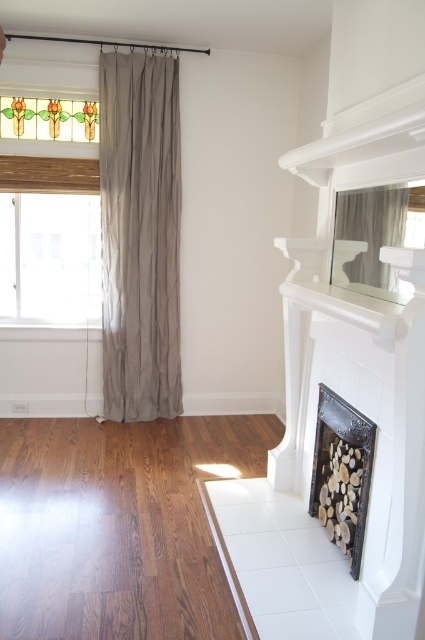
Can you confirm if dark brown wood flooring at lower left is smaller than stained glass window at upper left?

No, dark brown wood flooring at lower left is not smaller than stained glass window at upper left.

Consider the image. Can you confirm if dark brown wood flooring at lower left is positioned to the right of stained glass window at upper left?

Yes, dark brown wood flooring at lower left is to the right of stained glass window at upper left.

Does point (5, 547) come closer to viewer compared to point (76, 136)?

Yes.

At what (x,y) coordinates should I click in order to perform the action: click on dark brown wood flooring at lower left. Please return your answer as a coordinate pair (x, y). The width and height of the screenshot is (425, 640). Looking at the image, I should click on (118, 525).

Does black textured tile fireplace at center-right appear on the right side of stained glass window at upper left?

Indeed, black textured tile fireplace at center-right is positioned on the right side of stained glass window at upper left.

Does point (348, 452) lie behind point (22, 132)?

No, (348, 452) is closer to viewer.

Between point (350, 470) and point (51, 115), which one is positioned behind?

The point (51, 115) is more distant.

Locate an element on the screen. black textured tile fireplace at center-right is located at coordinates (342, 474).

What do you see at coordinates (50, 257) in the screenshot? The width and height of the screenshot is (425, 640). I see `clear glass window at left` at bounding box center [50, 257].

In the scene shown: Which is more to the right, clear glass window at left or black textured tile fireplace at center-right?

black textured tile fireplace at center-right is more to the right.

I want to click on clear glass window at left, so click(x=50, y=257).

Image resolution: width=425 pixels, height=640 pixels. What are the coordinates of `clear glass window at left` in the screenshot? It's located at (50, 257).